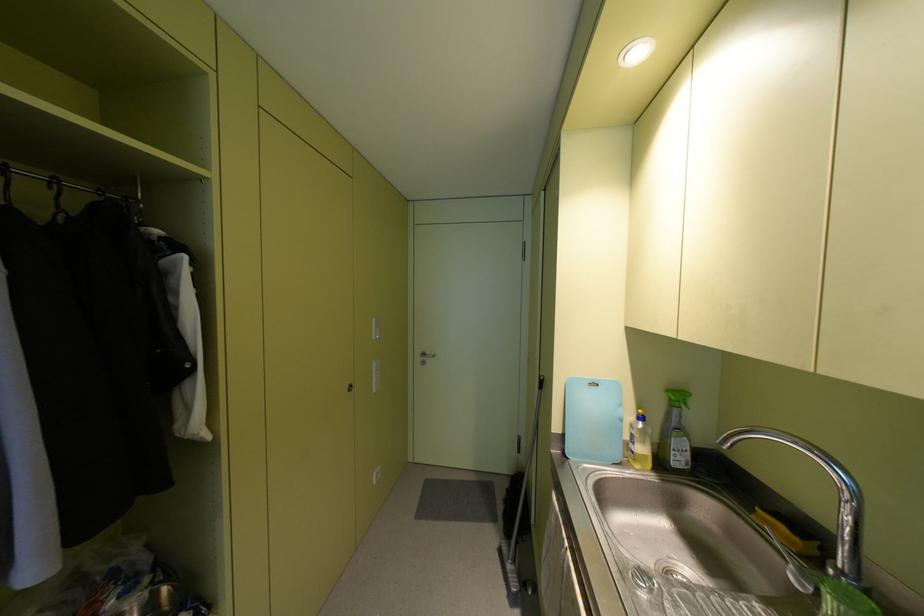
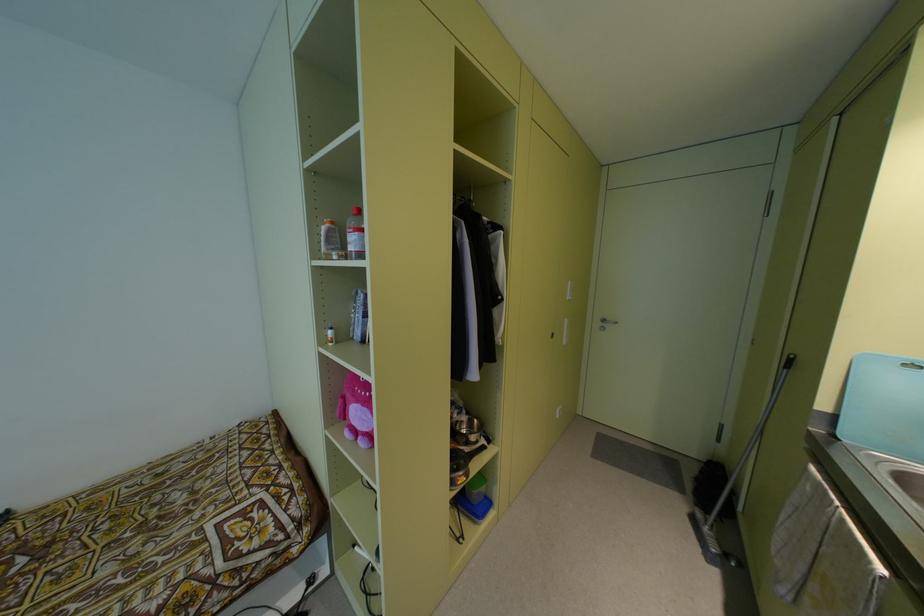
Question: The camera is either moving clockwise (left) or counter-clockwise (right) around the object. The first image is from the beginning of the video and the second image is from the end. Is the camera moving left or right when shooting the video?

Choices:
 (A) Left
 (B) Right

Answer: (B)